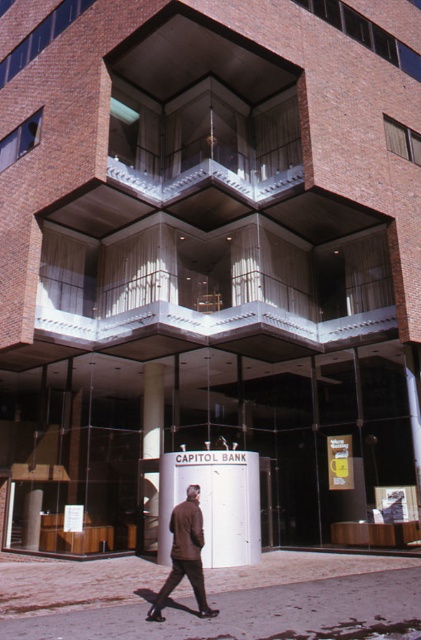
You are a delivery person trying to deliver a package to the bank entrance. You see the smooth concrete pavement at lower center and the brown leather jacket at lower center. Which object is higher in elevation?

The smooth concrete pavement at lower center is taller than the brown leather jacket at lower center, so the smooth concrete pavement at lower center is higher in elevation.

You are standing in front of the building and want to take a photo. You notice two points marked on the facade at coordinates point (141,465) and point (176,564). Which point is closer to your camera when taking the photo?

Point (176,564) is closer to the camera than point (141,465) because the description states that point (141,465) is further away.

You are a delivery person approaching the bank entrance. You need to place a heavy box on the smooth concrete pavement at lower center without hitting the white glossy pillar at center. Based on their positions, which side of the pillar should you position the box?

The smooth concrete pavement at lower center is to the right of the white glossy pillar at center, so you should place the box to the right side of the pillar to avoid hitting it.